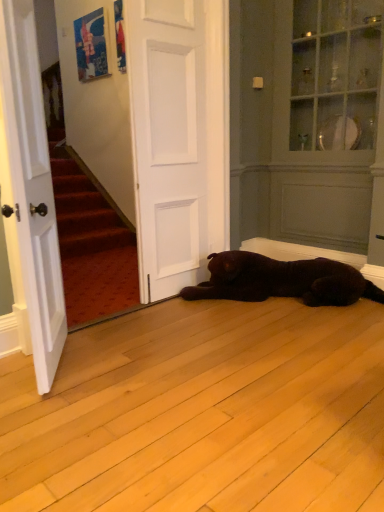
Question: From a real-world perspective, is matte white armoire at upper right physically located above or below white matte door at center, positioned as the 1th door in right-to-left order?

Choices:
 (A) below
 (B) above

Answer: (B)

Question: Visually, is matte white armoire at upper right positioned to the left or to the right of white matte door at center, marked as the 2th door in a left-to-right arrangement?

Choices:
 (A) left
 (B) right

Answer: (B)

Question: Estimate the real-world distances between objects in this image. Which object is closer to the matte white armoire at upper right?

Choices:
 (A) white matte door at center, which is counted as the second door, starting from the front
 (B) white wood door at left, which appears as the 2th door when viewed from the back

Answer: (A)

Question: Which is nearer to the white wood door at left, the first door from the front?

Choices:
 (A) white matte door at center, marked as the 2th door in a left-to-right arrangement
 (B) matte white armoire at upper right

Answer: (A)